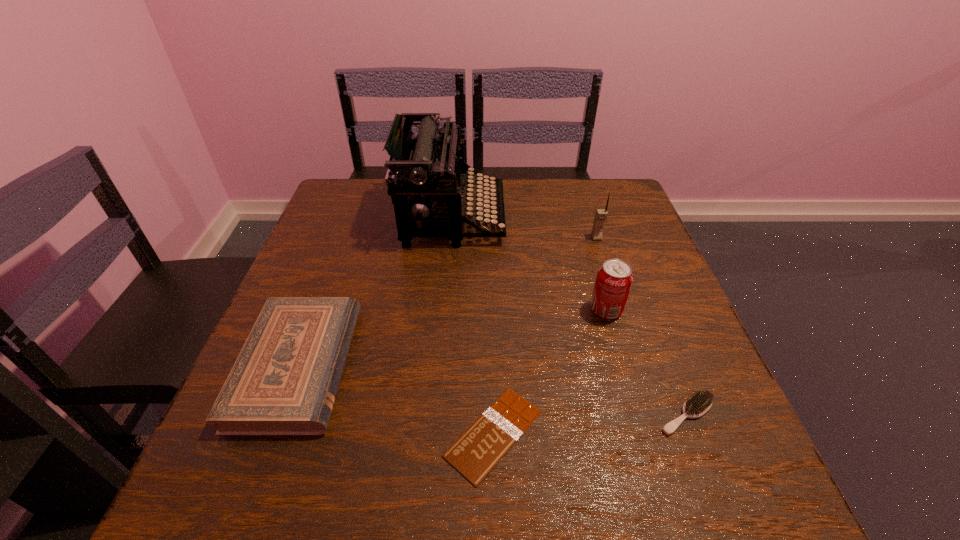
Locate an element on the screen. The height and width of the screenshot is (540, 960). the tallest object is located at coordinates (430, 171).

Image resolution: width=960 pixels, height=540 pixels. Find the location of `cellular telephone`. cellular telephone is located at coordinates (601, 214).

This screenshot has width=960, height=540. Find the location of `soda`. soda is located at coordinates (614, 279).

You are a GUI agent. You are given a task and a screenshot of the screen. Output one action in this format:
    pyautogui.click(x=<x>, y=<y>)
    Task: Click on the Bible
    Image resolution: width=960 pixels, height=540 pixels.
    Given the screenshot: What is the action you would take?
    pyautogui.click(x=284, y=381)

The height and width of the screenshot is (540, 960). Find the location of `the leftmost object`. the leftmost object is located at coordinates 284,381.

At what (x,y) coordinates should I click in order to perform the action: click on scrubbing brush. Please return your answer as a coordinate pair (x, y). Looking at the image, I should click on (699, 403).

This screenshot has height=540, width=960. What are the coordinates of `the shortest object` in the screenshot? It's located at (476, 452).

Where is `blank area located on the typing side of the typewriter`? Image resolution: width=960 pixels, height=540 pixels. blank area located on the typing side of the typewriter is located at coordinates (615, 217).

Identify the location of free space located on the front of the cellular telephone, where the keypad is located. The height and width of the screenshot is (540, 960). (619, 307).

You are a GUI agent. You are given a task and a screenshot of the screen. Output one action in this format:
    pyautogui.click(x=<x>, y=<y>)
    Task: Click on the vacant position located on the left of the soda
    The image size is (960, 540).
    Given the screenshot: What is the action you would take?
    pyautogui.click(x=467, y=310)